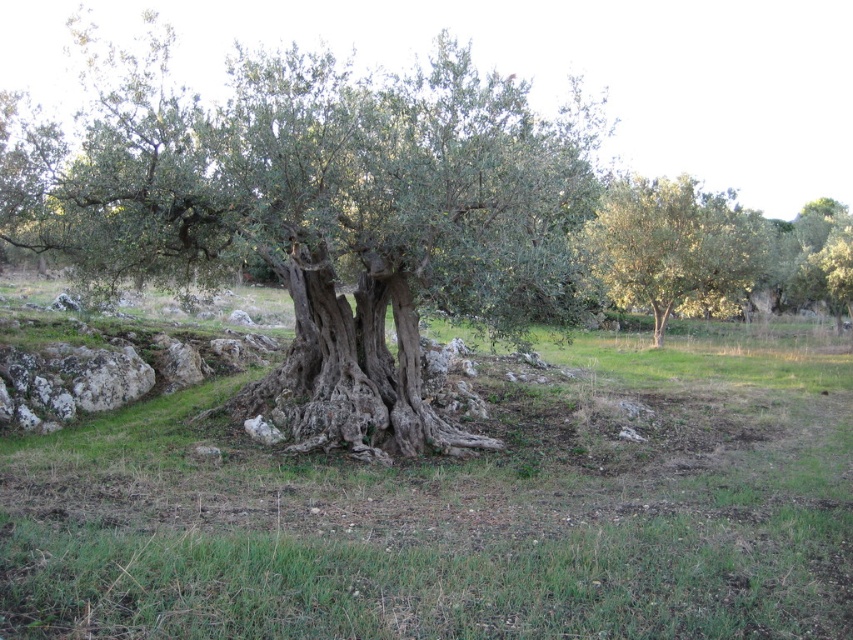
Who is taller, green grassy at center or green rough bark tree at center?

Standing taller between the two is green rough bark tree at center.

Who is shorter, green grassy at center or green rough bark tree at center?

With less height is green grassy at center.

At what (x,y) coordinates should I click in order to perform the action: click on green grassy at center. Please return your answer as a coordinate pair (x, y). The height and width of the screenshot is (640, 853). Looking at the image, I should click on (461, 509).

You are a GUI agent. You are given a task and a screenshot of the screen. Output one action in this format:
    pyautogui.click(x=<x>, y=<y>)
    Task: Click on the green grassy at center
    The image size is (853, 640).
    Given the screenshot: What is the action you would take?
    pyautogui.click(x=461, y=509)

Is green grassy at center bigger than green leafy tree at center?

No.

Can you confirm if green grassy at center is wider than green leafy tree at center?

Yes.

Between point (668, 400) and point (683, 275), which one is positioned behind?

Positioned behind is point (683, 275).

Identify the location of green grassy at center. (461, 509).

Is point (155, 147) positioned behind point (679, 241)?

No.

Find the location of a particular element. green rough bark tree at center is located at coordinates (323, 216).